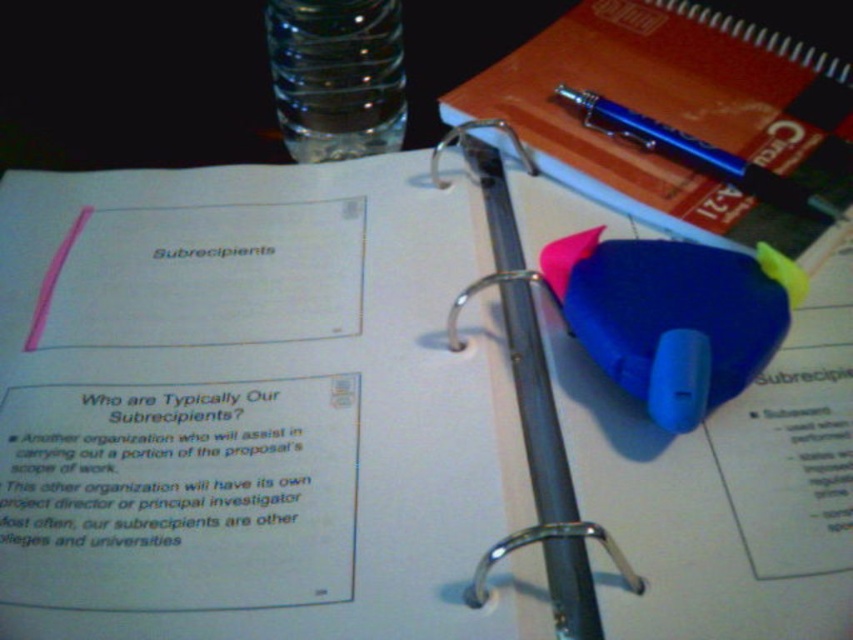
Does point (524, 410) come closer to viewer compared to point (375, 100)?

Yes.

Image resolution: width=853 pixels, height=640 pixels. What do you see at coordinates (531, 403) in the screenshot?
I see `blue plastic pen at center` at bounding box center [531, 403].

Is point (575, 518) less distant than point (367, 20)?

Yes.

Locate an element on the screen. The width and height of the screenshot is (853, 640). blue plastic pen at center is located at coordinates (531, 403).

Measure the distance between point (398, 340) and camera.

Point (398, 340) and camera are 41.53 centimeters apart.

Is white paper at center positioned in front of blue rubber eraser at center?

That is True.

Is point (160, 512) closer to camera compared to point (721, 317)?

Yes.

Where is `white paper at center`? Image resolution: width=853 pixels, height=640 pixels. white paper at center is located at coordinates (276, 412).

Is point (730, 102) behind point (724, 378)?

That is True.

Which of these two, orange matte notepad at upper right or blue rubber eraser at center, stands shorter?

Standing shorter between the two is blue rubber eraser at center.

Is point (746, 93) positioned behind point (735, 253)?

Yes, it is.

Identify the location of orange matte notepad at upper right. (674, 120).